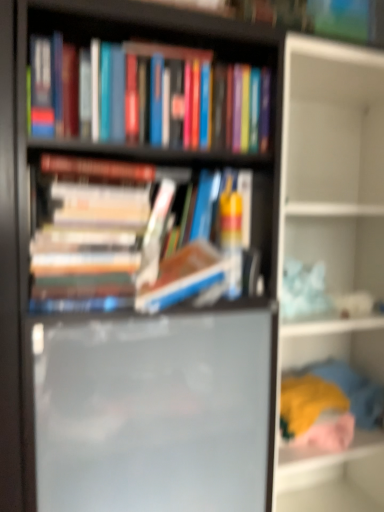
I want to click on soft fabric clothes at lower right, the first shelf ordered from the bottom, so click(329, 343).

I want to click on white matte shelf at upper right, which is the 2th shelf in bottom-to-top order, so point(333,193).

In order to face white matte shelf at upper right, the 1th shelf when ordered from top to bottom, should I rotate leftwards or rightwards?

Turn right by 20.938 degrees to look at white matte shelf at upper right, the 1th shelf when ordered from top to bottom.

You are a GUI agent. You are given a task and a screenshot of the screen. Output one action in this format:
    pyautogui.click(x=<x>, y=<y>)
    Task: Click on the hardcover books at center, positioned as the second book in top-to-bottom order
    This screenshot has width=384, height=512.
    Given the screenshot: What is the action you would take?
    pyautogui.click(x=93, y=232)

I want to click on hardcover books at upper center, which appears as the second book when ordered from the bottom, so click(x=177, y=99).

You are a GUI agent. You are given a task and a screenshot of the screen. Output one action in this format:
    pyautogui.click(x=<x>, y=<y>)
    Task: Click on the soft fabric clothes at lower right, the first shelf ordered from the bottom
    This screenshot has width=384, height=512.
    Given the screenshot: What is the action you would take?
    pyautogui.click(x=329, y=343)

How much distance is there between hardcover books at center, positioned as the second book in top-to-bottom order, and hardcover books at upper center, which appears as the second book when ordered from the bottom?

They are 7.34 inches apart.

Which of these two, hardcover books at center, which appears as the first book when ordered from the bottom, or hardcover books at upper center, which appears as the second book when ordered from the bottom, is thinner?

Thinner between the two is hardcover books at center, which appears as the first book when ordered from the bottom.

Identify the location of book above the hardcover books at center, which appears as the first book when ordered from the bottom (from a real-world perspective). [x=177, y=99].

Does hardcover books at center, positioned as the second book in top-to-bottom order, have a larger size compared to hardcover books at upper center, the 1th book from the top?

Incorrect, hardcover books at center, positioned as the second book in top-to-bottom order, is not larger than hardcover books at upper center, the 1th book from the top.

Which is more to the right, hardcover books at upper center, the 1th book from the top, or matte black bookshelf at center?

hardcover books at upper center, the 1th book from the top.

Is hardcover books at upper center, the 1th book from the top, taller or shorter than matte black bookshelf at center?

Considering their sizes, hardcover books at upper center, the 1th book from the top, has less height than matte black bookshelf at center.

Looking at this image, from a real-world perspective, who is located lower, hardcover books at upper center, the 1th book from the top, or matte black bookshelf at center?

matte black bookshelf at center is physically lower.

Which point is more forward, (150,57) or (232,40)?

The point (150,57) is closer to the camera.

The image size is (384, 512). Identify the location of shelf that is the 1st one when counting rightward from the hardcover books at center, which appears as the first book when ordered from the bottom. (329, 343).

Considering the positions of point (309, 346) and point (41, 234), is point (309, 346) closer or farther from the camera than point (41, 234)?

Clearly, point (309, 346) is more distant from the camera than point (41, 234).

Considering the sizes of objects soft fabric clothes at lower right, the second shelf in the top-to-bottom sequence, and hardcover books at center, which appears as the first book when ordered from the bottom, in the image provided, who is wider, soft fabric clothes at lower right, the second shelf in the top-to-bottom sequence, or hardcover books at center, which appears as the first book when ordered from the bottom,?

With larger width is soft fabric clothes at lower right, the second shelf in the top-to-bottom sequence.

From the image's perspective, between soft fabric clothes at lower right, the second shelf in the top-to-bottom sequence, and hardcover books at center, positioned as the second book in top-to-bottom order, who is located below?

soft fabric clothes at lower right, the second shelf in the top-to-bottom sequence.

How different are the orientations of white matte shelf at upper right, the 1th shelf when ordered from top to bottom, and matte black bookshelf at center in degrees?

The angular difference between white matte shelf at upper right, the 1th shelf when ordered from top to bottom, and matte black bookshelf at center is 0.916 degrees.

From the picture: Considering the sizes of objects white matte shelf at upper right, the 1th shelf when ordered from top to bottom, and matte black bookshelf at center in the image provided, who is smaller, white matte shelf at upper right, the 1th shelf when ordered from top to bottom, or matte black bookshelf at center?

matte black bookshelf at center is smaller.

Which is correct: white matte shelf at upper right, which is the 2th shelf in bottom-to-top order, is inside matte black bookshelf at center, or outside of it?

white matte shelf at upper right, which is the 2th shelf in bottom-to-top order, cannot be found inside matte black bookshelf at center.

From a real-world perspective, which object rests below the other?

white matte shelf at upper right, the 1th shelf when ordered from top to bottom.

Who is taller, hardcover books at upper center, which appears as the second book when ordered from the bottom, or white matte shelf at upper right, the 1th shelf when ordered from top to bottom?

white matte shelf at upper right, the 1th shelf when ordered from top to bottom.

From a real-world perspective, is hardcover books at upper center, the 1th book from the top, physically above white matte shelf at upper right, the 1th shelf when ordered from top to bottom?

Yes, from a real-world perspective, hardcover books at upper center, the 1th book from the top, is over white matte shelf at upper right, the 1th shelf when ordered from top to bottom

Does hardcover books at upper center, which appears as the second book when ordered from the bottom, turn towards white matte shelf at upper right, which is the 2th shelf in bottom-to-top order?

No, hardcover books at upper center, which appears as the second book when ordered from the bottom, is not facing towards white matte shelf at upper right, which is the 2th shelf in bottom-to-top order.

Does hardcover books at upper center, the 1th book from the top, have a smaller size compared to white matte shelf at upper right, which is the 2th shelf in bottom-to-top order?

Indeed, hardcover books at upper center, the 1th book from the top, has a smaller size compared to white matte shelf at upper right, which is the 2th shelf in bottom-to-top order.

Is matte black bookshelf at center positioned with its back to soft fabric clothes at lower right, the first shelf ordered from the bottom?

matte black bookshelf at center is not turned away from soft fabric clothes at lower right, the first shelf ordered from the bottom.

Is matte black bookshelf at center touching soft fabric clothes at lower right, the first shelf ordered from the bottom?

No, matte black bookshelf at center is not beside soft fabric clothes at lower right, the first shelf ordered from the bottom.

Can you tell me how much matte black bookshelf at center and soft fabric clothes at lower right, the first shelf ordered from the bottom, differ in facing direction?

The angular difference between matte black bookshelf at center and soft fabric clothes at lower right, the first shelf ordered from the bottom, is 1.25 degrees.

Does point (144, 8) appear closer or farther from the camera than point (284, 337)?

Point (144, 8) is closer to the camera than point (284, 337).

Would you consider matte black bookshelf at center to be distant from hardcover books at center, which appears as the first book when ordered from the bottom?

No, there isn't a large distance between matte black bookshelf at center and hardcover books at center, which appears as the first book when ordered from the bottom.

In the image, is matte black bookshelf at center positioned in front of or behind hardcover books at center, which appears as the first book when ordered from the bottom?

matte black bookshelf at center is in front of hardcover books at center, which appears as the first book when ordered from the bottom.

Is matte black bookshelf at center not inside hardcover books at center, positioned as the second book in top-to-bottom order?

Indeed, matte black bookshelf at center is completely outside hardcover books at center, positioned as the second book in top-to-bottom order.

Based on the photo, considering the sizes of objects matte black bookshelf at center and hardcover books at center, positioned as the second book in top-to-bottom order, in the image provided, who is wider, matte black bookshelf at center or hardcover books at center, positioned as the second book in top-to-bottom order,?

matte black bookshelf at center.

Identify the location of book behind the hardcover books at center, which appears as the first book when ordered from the bottom. This screenshot has height=512, width=384. (177, 99).

Find the location of a particular element. The width and height of the screenshot is (384, 512). bookshelf on the left of the hardcover books at upper center, which appears as the second book when ordered from the bottom is located at coordinates (165, 33).

When comparing their distances from hardcover books at center, positioned as the second book in top-to-bottom order, does matte black bookshelf at center or white matte shelf at upper right, which is the 2th shelf in bottom-to-top order, seem further?

white matte shelf at upper right, which is the 2th shelf in bottom-to-top order.

Based on their spatial positions, is hardcover books at center, positioned as the second book in top-to-bottom order, or matte black bookshelf at center closer to hardcover books at upper center, the 1th book from the top?

Among the two, matte black bookshelf at center is located nearer to hardcover books at upper center, the 1th book from the top.

From the image, which object appears to be nearer to white matte shelf at upper right, which is the 2th shelf in bottom-to-top order, hardcover books at upper center, which appears as the second book when ordered from the bottom, or soft fabric clothes at lower right, the first shelf ordered from the bottom?

The object closer to white matte shelf at upper right, which is the 2th shelf in bottom-to-top order, is soft fabric clothes at lower right, the first shelf ordered from the bottom.

When comparing their distances from hardcover books at upper center, the 1th book from the top, does matte black bookshelf at center or hardcover books at center, positioned as the second book in top-to-bottom order, seem further?

Among the two, hardcover books at center, positioned as the second book in top-to-bottom order, is located further to hardcover books at upper center, the 1th book from the top.

Which object lies nearer to the anchor point hardcover books at upper center, the 1th book from the top, matte black bookshelf at center or soft fabric clothes at lower right, the second shelf in the top-to-bottom sequence?

matte black bookshelf at center.

Which object lies nearer to the anchor point soft fabric clothes at lower right, the first shelf ordered from the bottom, hardcover books at center, positioned as the second book in top-to-bottom order, or white matte shelf at upper right, which is the 2th shelf in bottom-to-top order?

The object closer to soft fabric clothes at lower right, the first shelf ordered from the bottom, is white matte shelf at upper right, which is the 2th shelf in bottom-to-top order.

Which object lies nearer to the anchor point hardcover books at center, positioned as the second book in top-to-bottom order, soft fabric clothes at lower right, the first shelf ordered from the bottom, or matte black bookshelf at center?

matte black bookshelf at center is closer to hardcover books at center, positioned as the second book in top-to-bottom order.

Looking at the image, which one is located further to white matte shelf at upper right, which is the 2th shelf in bottom-to-top order, hardcover books at center, positioned as the second book in top-to-bottom order, or hardcover books at upper center, which appears as the second book when ordered from the bottom?

Among the two, hardcover books at center, positioned as the second book in top-to-bottom order, is located further to white matte shelf at upper right, which is the 2th shelf in bottom-to-top order.

I want to click on shelf located between matte black bookshelf at center and white matte shelf at upper right, the 1th shelf when ordered from top to bottom, in the left-right direction, so click(x=329, y=343).

This screenshot has height=512, width=384. Identify the location of bookshelf between hardcover books at upper center, the 1th book from the top, and soft fabric clothes at lower right, the second shelf in the top-to-bottom sequence, vertically. (165, 33).

Where is `shelf between hardcover books at upper center, the 1th book from the top, and soft fabric clothes at lower right, the first shelf ordered from the bottom, in the up-down direction`? The height and width of the screenshot is (512, 384). shelf between hardcover books at upper center, the 1th book from the top, and soft fabric clothes at lower right, the first shelf ordered from the bottom, in the up-down direction is located at coordinates (333, 193).

This screenshot has width=384, height=512. I want to click on bookshelf between hardcover books at center, positioned as the second book in top-to-bottom order, and soft fabric clothes at lower right, the second shelf in the top-to-bottom sequence, from left to right, so click(x=165, y=33).